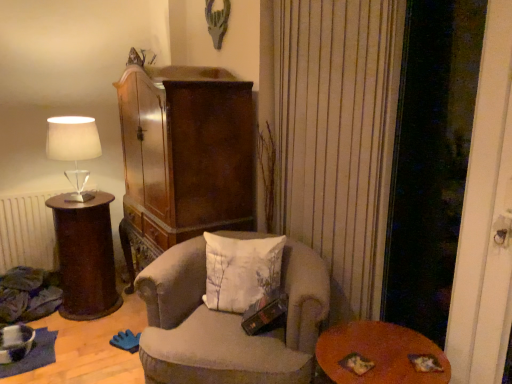
Find the location of a particular element. free location above wooden round table at lower right (from a real-world perspective) is located at coordinates click(373, 348).